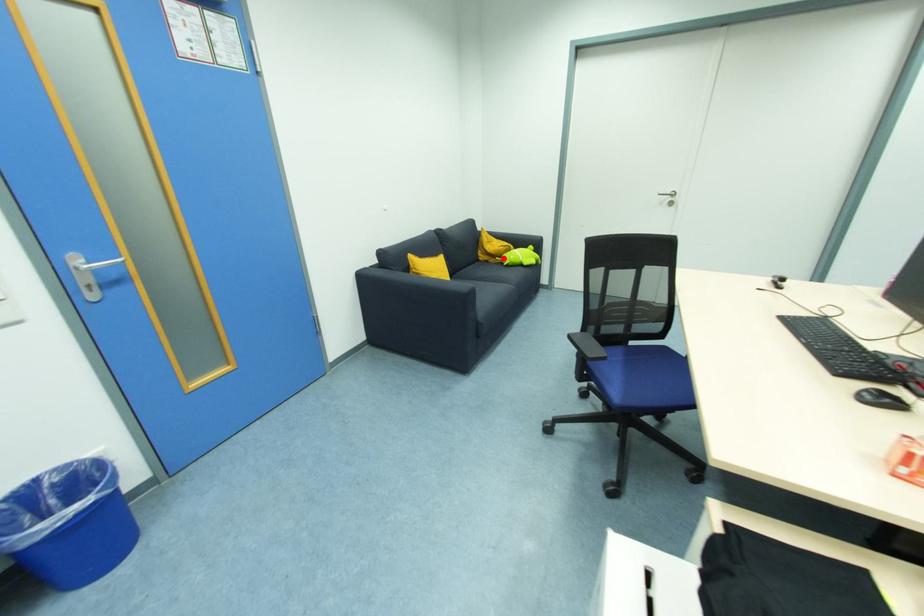
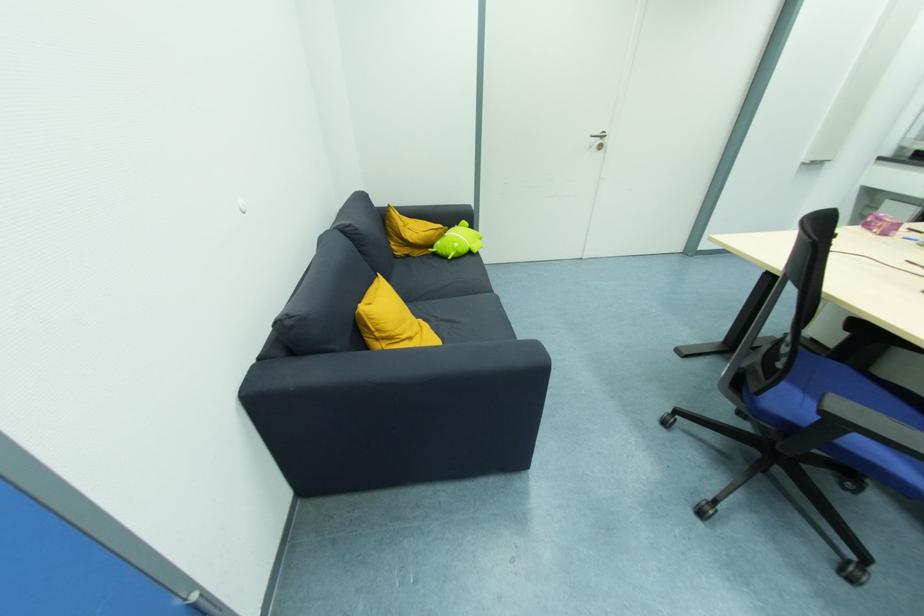
In the second image, find the point that corresponds to the highlighted location in the first image.

(435, 248)